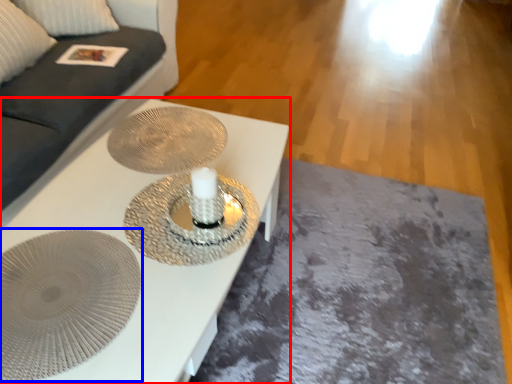
Question: Which of the following is the farthest to the observer, table (highlighted by a red box) or oval (highlighted by a blue box)?

Choices:
 (A) table
 (B) oval

Answer: (B)